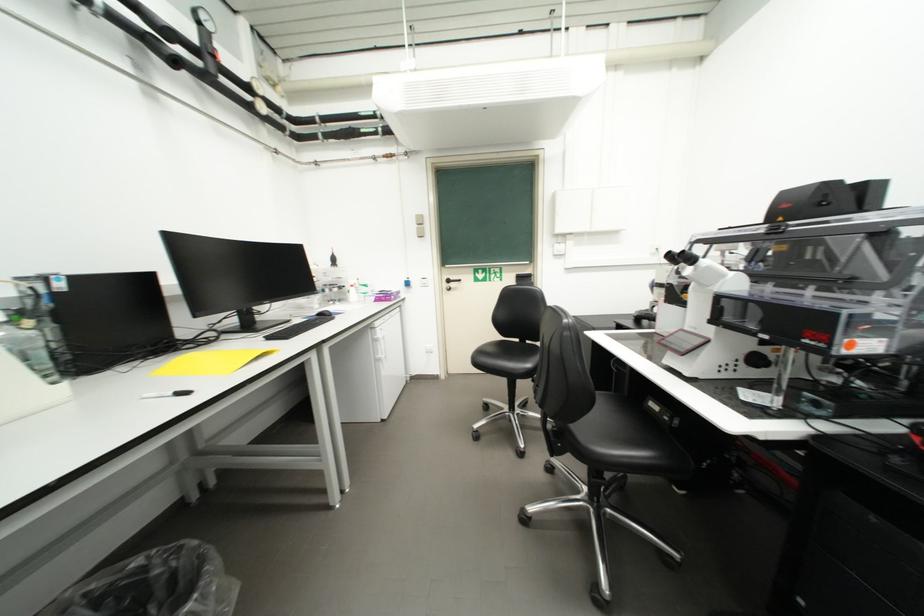
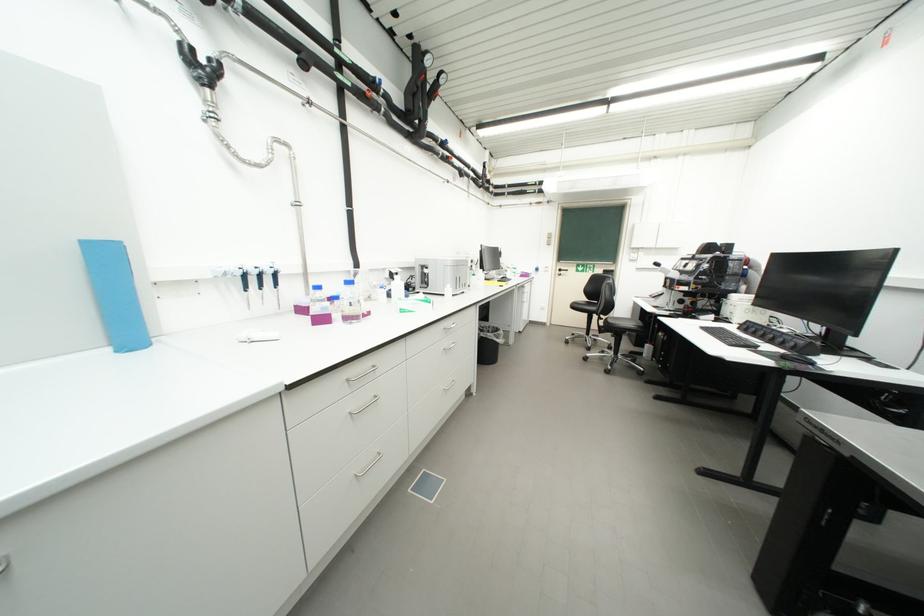
Question: I am providing you with two images of the same scene from different viewpoints. Which of the following objects are not visible in image2?

Choices:
 (A) purple cardboard box
 (B) blue shoe box
 (C) black computer mouse
 (D) plastic bottle

Answer: (C)